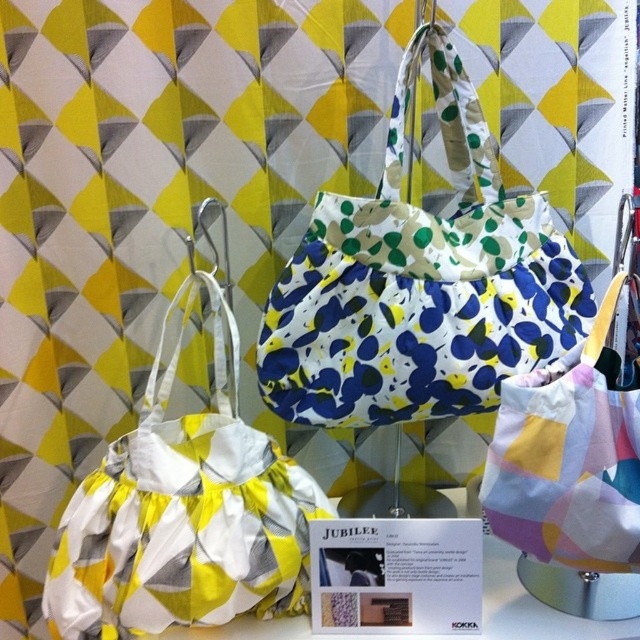
You are organizing a store display and need to place the white satin bag at left and the yellow and white fabric bag at center on a shelf. The shelf has a width of 1.2 meters. Can both bags fit side by side without overlapping?

The white satin bag at left is wider than the yellow and white fabric bag at center. However, since the shelf is 1.2 meters wide, both can fit side by side as long as their combined widths do not exceed 1.2 meters. The exact fit depends on their individual widths, but since the white satin bag is wider, it would occupy more space, but without specific measurements, we can assume they can fit if arranged properly.

You are organizing a store display and need to know the arrangement of the white satin bag at left and the yellow and white fabric bag at center. Which one is placed higher in the display?

The yellow and white fabric bag at center is placed higher because the white satin bag at left is positioned under it.